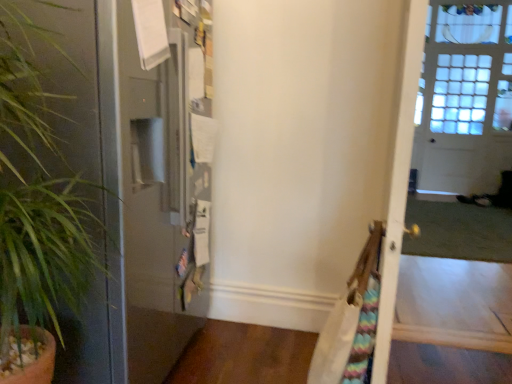
Question: Would you say green leafy plant at left is a long distance from clear glass screen door at right?

Choices:
 (A) yes
 (B) no

Answer: (A)

Question: Considering the relative sizes of green leafy plant at left and clear glass screen door at right in the image provided, is green leafy plant at left smaller than clear glass screen door at right?

Choices:
 (A) no
 (B) yes

Answer: (B)

Question: From the image's perspective, would you say green leafy plant at left is shown under clear glass screen door at right?

Choices:
 (A) no
 (B) yes

Answer: (B)

Question: Does green leafy plant at left lie behind clear glass screen door at right?

Choices:
 (A) no
 (B) yes

Answer: (A)

Question: Could you tell me if green leafy plant at left is turned towards clear glass screen door at right?

Choices:
 (A) yes
 (B) no

Answer: (B)

Question: Is green leafy plant at left wider than clear glass screen door at right?

Choices:
 (A) no
 (B) yes

Answer: (B)

Question: Does clear glass screen door at right have a lesser width compared to green leafy plant at left?

Choices:
 (A) yes
 (B) no

Answer: (A)

Question: Is clear glass screen door at right far from green leafy plant at left?

Choices:
 (A) no
 (B) yes

Answer: (B)

Question: Is clear glass screen door at right at the left side of green leafy plant at left?

Choices:
 (A) no
 (B) yes

Answer: (A)

Question: Is clear glass screen door at right positioned before green leafy plant at left?

Choices:
 (A) no
 (B) yes

Answer: (A)

Question: From the image's perspective, is clear glass screen door at right under green leafy plant at left?

Choices:
 (A) yes
 (B) no

Answer: (B)

Question: From the image's perspective, is clear glass screen door at right on green leafy plant at left?

Choices:
 (A) yes
 (B) no

Answer: (A)

Question: In terms of height, does clear glass screen door at right look taller or shorter compared to green leafy plant at left?

Choices:
 (A) tall
 (B) short

Answer: (A)